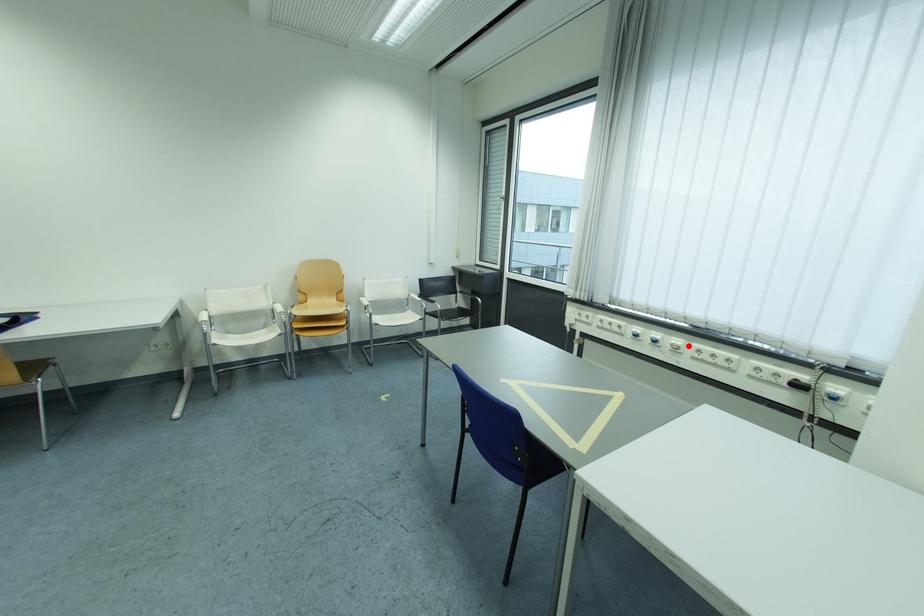
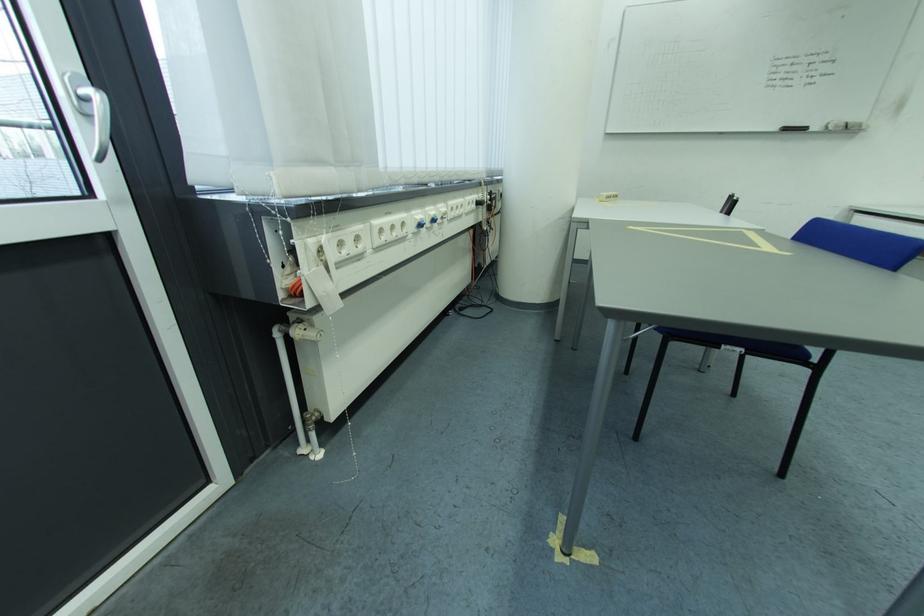
The point at the highlighted location is marked in the first image. Where is the corresponding point in the second image?

(454, 212)